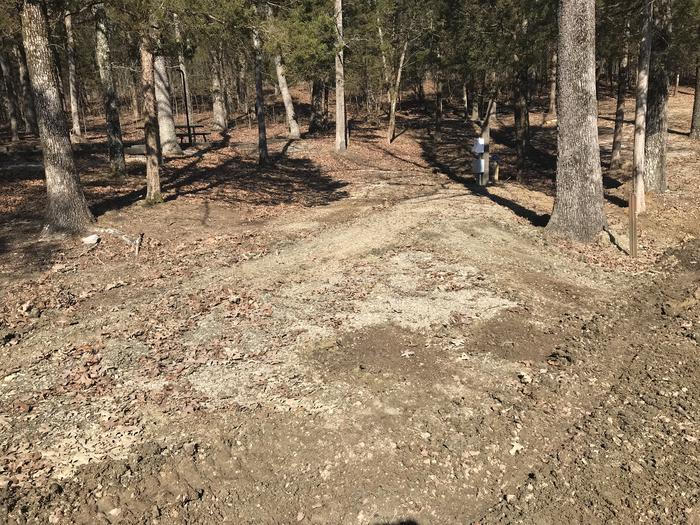
Identify the location of pole which holds light. (186, 94), (188, 120).